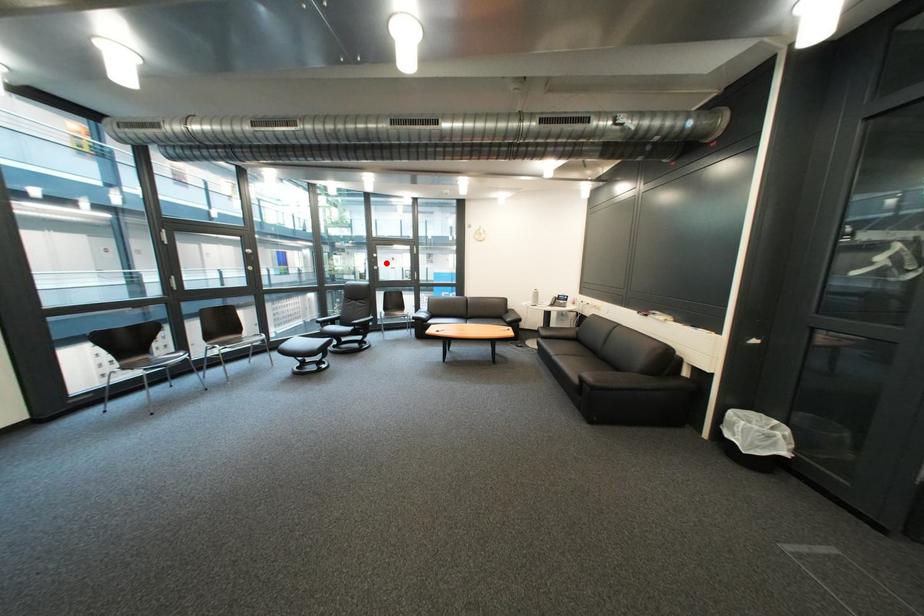
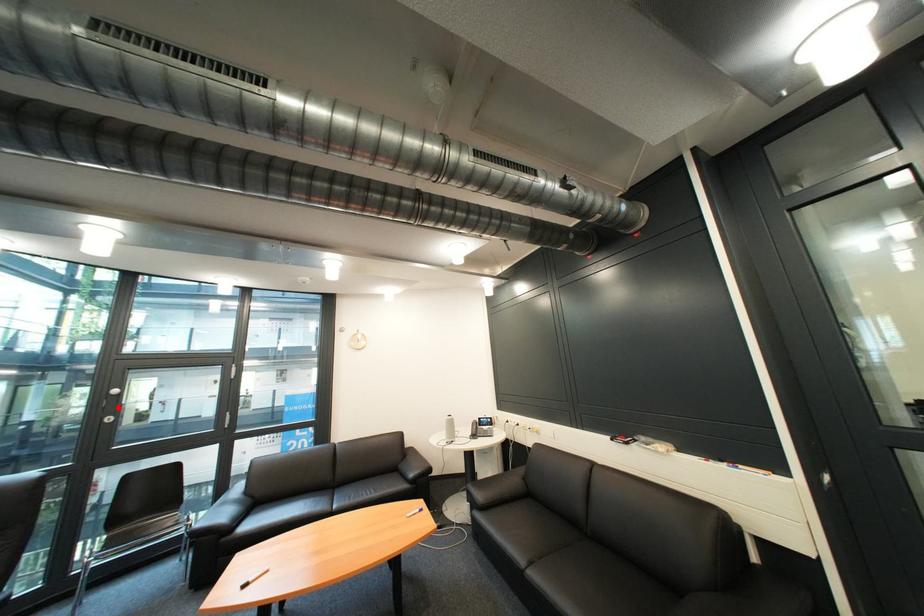
I am providing you with two images of the same scene from different viewpoints. A red point is marked on the first image and another point is marked on the second image. Are the points marked in image1 and image2 representing the same 3D position?

Yes